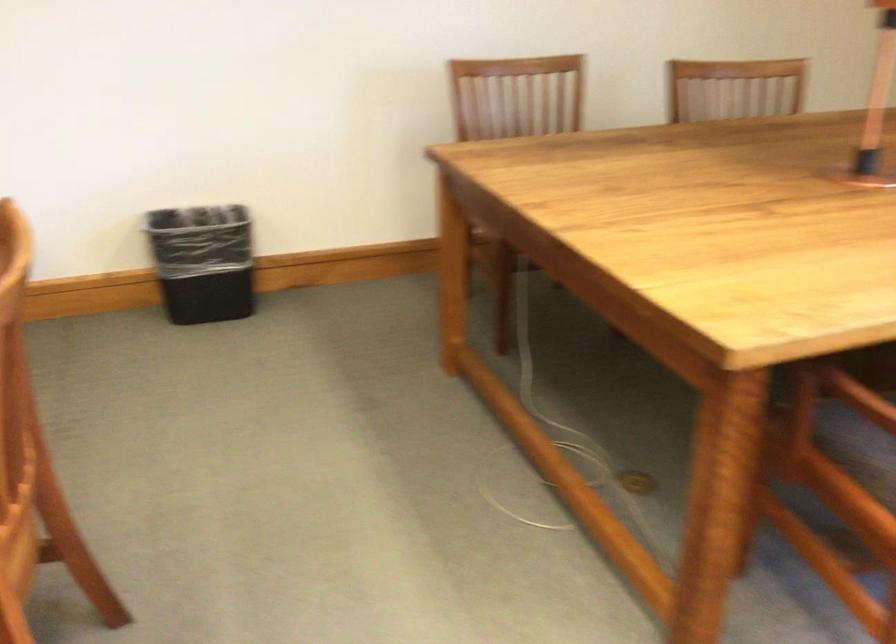
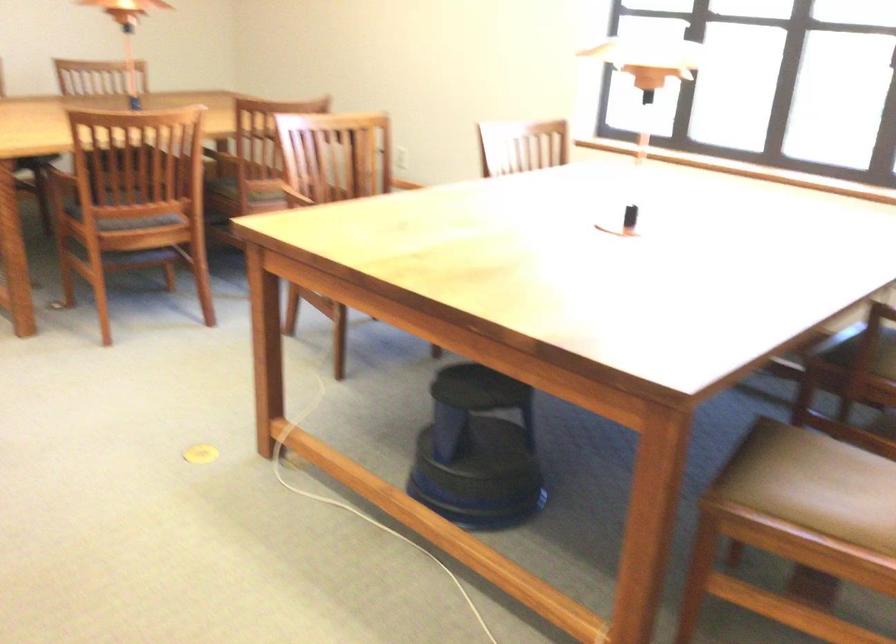
Question: I am providing you with two images of the same scene from different viewpoints. Which of the following objects are not visible in image2?

Choices:
 (A) tripod head handle
 (B) chair sitting surface
 (C) brown chair armrest
 (D) brown chair sitting surface

Answer: (B)